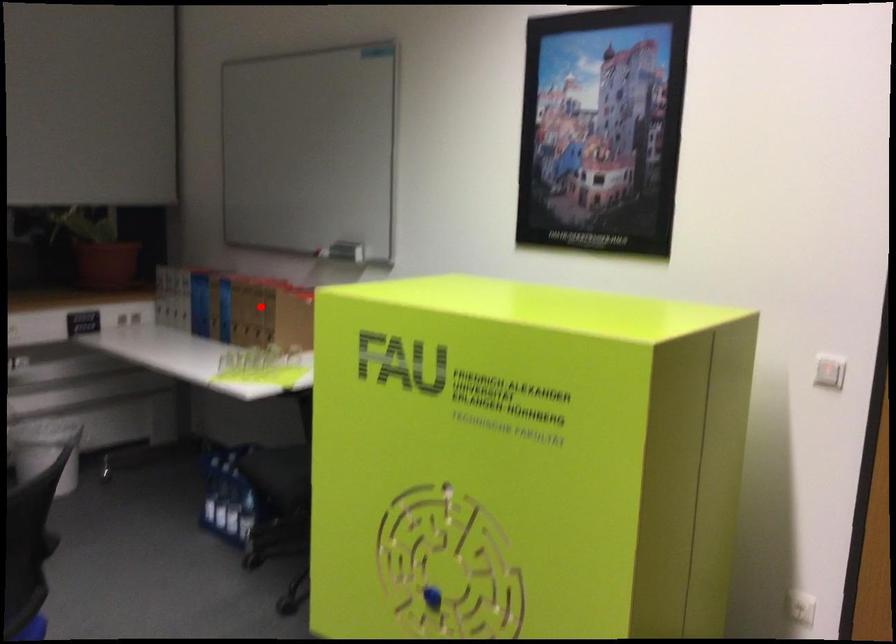
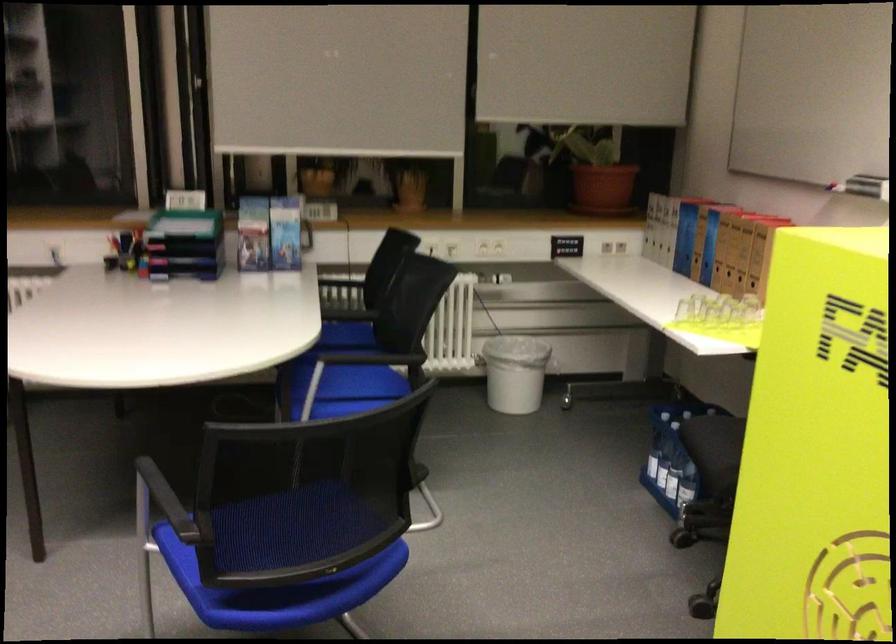
Question: I am providing you with two images of the same scene from different viewpoints. A red point is shown in image1. For the corresponding object point in image2, is it positioned nearer or farther from the camera?

Choices:
 (A) Nearer
 (B) Farther

Answer: (A)